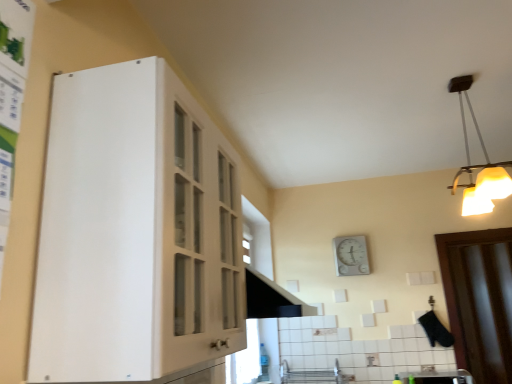
This screenshot has width=512, height=384. What do you see at coordinates (479, 165) in the screenshot? I see `white plastic light fixture at upper right` at bounding box center [479, 165].

The image size is (512, 384). In order to click on white plastic light fixture at upper right in this screenshot , I will do `click(479, 165)`.

Where is `white plastic light fixture at upper right`? The width and height of the screenshot is (512, 384). white plastic light fixture at upper right is located at coordinates (479, 165).

Considering the positions of point (79, 254) and point (344, 272), is point (79, 254) closer or farther from the camera than point (344, 272)?

Point (79, 254).

Based on their positions, is white matte cabinet at left located to the left or right of white plastic clock at upper center?

From the image, it's evident that white matte cabinet at left is to the left of white plastic clock at upper center.

How many degrees apart are the facing directions of white matte cabinet at left and white plastic clock at upper center?

The angle between the facing direction of white matte cabinet at left and the facing direction of white plastic clock at upper center is 91.1 degrees.

From the picture: Is white matte cabinet at left aimed at white plastic clock at upper center?

No, white matte cabinet at left does not turn towards white plastic clock at upper center.

Is white glossy sink at lower right far from white matte cabinet at left?

Yes, white glossy sink at lower right is far from white matte cabinet at left.

Considering the sizes of objects white glossy sink at lower right and white matte cabinet at left in the image provided, who is bigger, white glossy sink at lower right or white matte cabinet at left?

white matte cabinet at left.

Considering their positions, is white glossy sink at lower right located in front of or behind white matte cabinet at left?

In the image, white glossy sink at lower right appears behind white matte cabinet at left.

Considering their positions, is white glossy sink at lower right located in front of or behind white plastic light fixture at upper right?

white glossy sink at lower right is positioned farther from the viewer than white plastic light fixture at upper right.

From the image's perspective, is white glossy sink at lower right beneath white plastic light fixture at upper right?

Yes, from the image's perspective, white glossy sink at lower right is beneath white plastic light fixture at upper right.

Is white glossy sink at lower right with white plastic light fixture at upper right?

There is a gap between white glossy sink at lower right and white plastic light fixture at upper right.

Does white glossy sink at lower right have a greater height compared to white plastic light fixture at upper right?

No, white glossy sink at lower right is not taller than white plastic light fixture at upper right.

Between white plastic light fixture at upper right and white plastic clock at upper center, which one has smaller width?

With smaller width is white plastic clock at upper center.

Considering the positions of objects white plastic light fixture at upper right and white plastic clock at upper center in the image provided, who is more to the right, white plastic light fixture at upper right or white plastic clock at upper center?

white plastic light fixture at upper right is more to the right.

Considering the sizes of objects white plastic light fixture at upper right and white plastic clock at upper center in the image provided, who is bigger, white plastic light fixture at upper right or white plastic clock at upper center?

white plastic light fixture at upper right is bigger.

I want to click on light fixture above the white plastic clock at upper center (from a real-world perspective), so click(479, 165).

Is brown wooden door at right outside of white matte cabinet at left?

Indeed, brown wooden door at right is completely outside white matte cabinet at left.

Considering the positions of point (505, 249) and point (59, 273), is point (505, 249) closer or farther from the camera than point (59, 273)?

Point (505, 249).

Does brown wooden door at right come behind white matte cabinet at left?

Yes, brown wooden door at right is behind white matte cabinet at left.

In order to click on sink below the white plastic light fixture at upper right (from the image's perspective) in this screenshot , I will do `click(437, 377)`.

In the scene shown: Does white plastic light fixture at upper right have a greater width compared to white glossy sink at lower right?

No.

Is white plastic light fixture at upper right next to white glossy sink at lower right?

No, white plastic light fixture at upper right is not touching white glossy sink at lower right.

Does point (494, 188) come closer to viewer compared to point (463, 373)?

Yes, it is in front of point (463, 373).

Which of these two, white plastic clock at upper center or white matte cabinet at left, is wider?

white matte cabinet at left.

In the scene shown: From a real-world perspective, who is located lower, white plastic clock at upper center or white matte cabinet at left?

In real-world perspective, white matte cabinet at left is lower.

Which of these two, white plastic clock at upper center or white matte cabinet at left, is smaller?

With smaller size is white plastic clock at upper center.

Is white plastic clock at upper center oriented towards white matte cabinet at left?

Yes, white plastic clock at upper center is aimed at white matte cabinet at left.

Identify the location of cabinetry in front of the white plastic clock at upper center. The height and width of the screenshot is (384, 512). (135, 231).

Where is `cabinetry that is on the left side of white glossy sink at lower right`? cabinetry that is on the left side of white glossy sink at lower right is located at coordinates (135, 231).

From the image, which object appears to be nearer to brown wooden door at right, white matte cabinet at left or white plastic clock at upper center?

white plastic clock at upper center is positioned closer to the anchor brown wooden door at right.

Looking at this image, based on their spatial positions, is brown wooden door at right or white matte cabinet at left closer to white plastic clock at upper center?

brown wooden door at right is positioned closer to the anchor white plastic clock at upper center.

Considering their positions, is white glossy sink at lower right positioned further to white plastic light fixture at upper right than white plastic clock at upper center?

white glossy sink at lower right is further to white plastic light fixture at upper right.

Estimate the real-world distances between objects in this image. Which object is further from white plastic light fixture at upper right, brown wooden door at right or white glossy sink at lower right?

Among the two, white glossy sink at lower right is located further to white plastic light fixture at upper right.

When comparing their distances from white plastic clock at upper center, does white plastic light fixture at upper right or white glossy sink at lower right seem further?

The object further to white plastic clock at upper center is white plastic light fixture at upper right.

From the image, which object appears to be nearer to white glossy sink at lower right, white matte cabinet at left or white plastic clock at upper center?

white plastic clock at upper center lies closer to white glossy sink at lower right than the other object.

Based on their spatial positions, is white plastic light fixture at upper right or white plastic clock at upper center further from white glossy sink at lower right?

white plastic light fixture at upper right is positioned further to the anchor white glossy sink at lower right.

Looking at the image, which one is located further to white matte cabinet at left, white glossy sink at lower right or white plastic clock at upper center?

white glossy sink at lower right.

Find the location of a particular element. light fixture between white matte cabinet at left and brown wooden door at right from front to back is located at coordinates (479, 165).

Where is `light fixture between white matte cabinet at left and white glossy sink at lower right in the front-back direction`? light fixture between white matte cabinet at left and white glossy sink at lower right in the front-back direction is located at coordinates (479, 165).

Locate an element on the screen. door between white plastic light fixture at upper right and white glossy sink at lower right in the up-down direction is located at coordinates (479, 300).

This screenshot has width=512, height=384. Identify the location of sink between white plastic light fixture at upper right and white plastic clock at upper center along the z-axis. (437, 377).